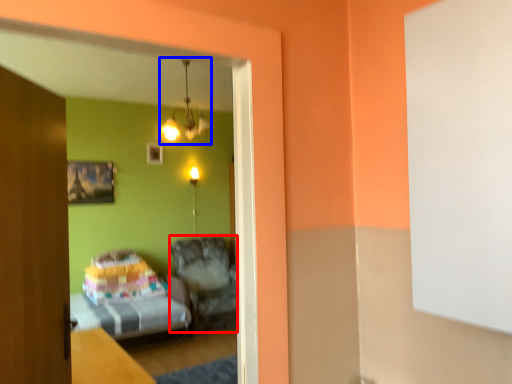
Question: Which object is further to the camera taking this photo, furniture (highlighted by a red box) or chandelier (highlighted by a blue box)?

Choices:
 (A) furniture
 (B) chandelier

Answer: (A)